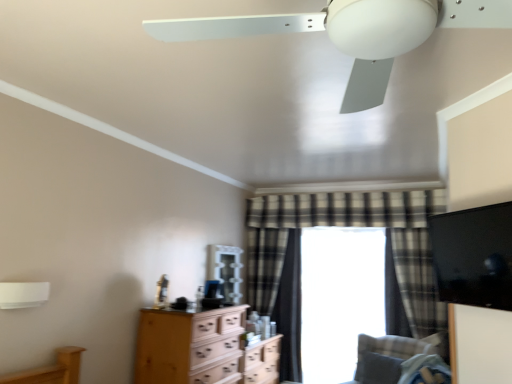
Question: Is white matte lamp at upper left inside or outside of plaid fabric curtain at center, placed as the 1th curtain when sorted from left to right?

Choices:
 (A) inside
 (B) outside

Answer: (B)

Question: In the image, is white matte lamp at upper left on the left side or the right side of plaid fabric curtain at center, placed as the 1th curtain when sorted from left to right?

Choices:
 (A) right
 (B) left

Answer: (B)

Question: Which is nearer to the plaid fabric curtain at center, the second curtain from the right?

Choices:
 (A) light brown wood chest of drawers at center
 (B) white matte lamp at upper left
 (C) transparent glass window at center
 (D) plaid fabric curtain at center, positioned as the first curtain in right-to-left order
 (E) plaid fabric curtain at center, the 3th curtain from the right

Answer: (E)

Question: Which object is the farthest from the white matte lamp at upper left?

Choices:
 (A) plaid fabric curtain at center, positioned as the first curtain in right-to-left order
 (B) white matte ceiling fan at upper center
 (C) gray fabric pillow at lower right
 (D) transparent glass window at center
 (E) velvet gray swivel chair at lower right

Answer: (A)